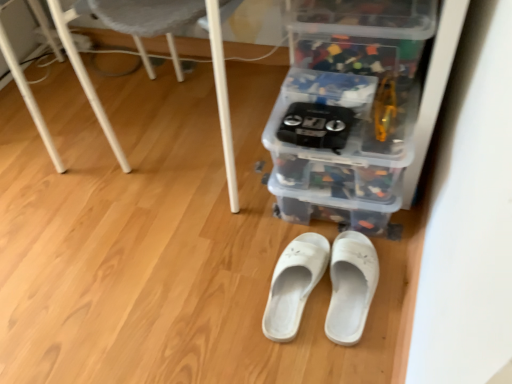
Identify the location of free point above transparent plastic storage box at center, the 2th storage box positioned from the bottom (from a real-world perspective). The width and height of the screenshot is (512, 384). (347, 70).